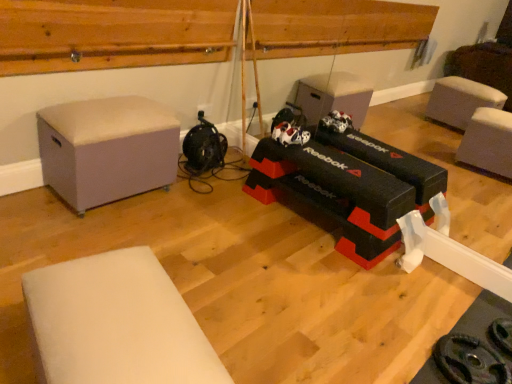
You are a GUI agent. You are given a task and a screenshot of the screen. Output one action in this format:
    pyautogui.click(x=<x>, y=<y>)
    Task: Click on the vacant area on top of white foam mat at lower left, which is the 1th furniture in front-to-back order (from a real-world perspective)
    
    Given the screenshot: What is the action you would take?
    pyautogui.click(x=120, y=306)